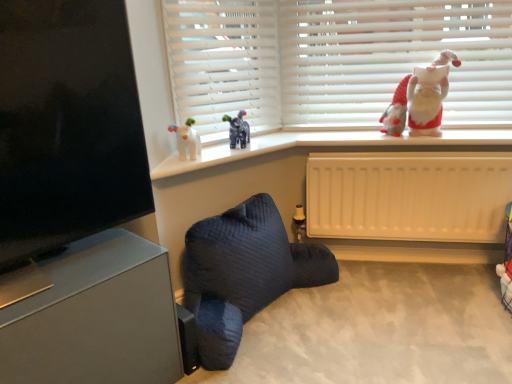
Find the location of a particular element. vacant area situated below black matte screen at upper left (from a real-world perspective) is located at coordinates (58, 263).